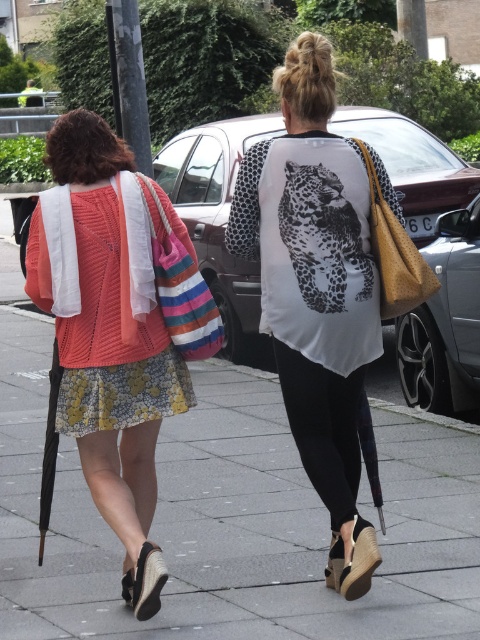
Question: Is gray concrete pavement at lower center behind knitted cotton sweater at left?

Choices:
 (A) yes
 (B) no

Answer: (A)

Question: Which object is farther from the camera taking this photo?

Choices:
 (A) white matte shirt at center
 (B) knitted cotton sweater at left
 (C) metallic silver car at center

Answer: (C)

Question: Which object appears closest to the camera in this image?

Choices:
 (A) gray concrete pavement at lower center
 (B) printed cotton dress at center
 (C) metallic silver car at center
 (D) white matte shirt at center

Answer: (D)

Question: Can you confirm if white matte shirt at center is wider than shiny black car at right?

Choices:
 (A) no
 (B) yes

Answer: (B)

Question: Does gray concrete pavement at lower center have a greater width compared to white matte shirt at center?

Choices:
 (A) no
 (B) yes

Answer: (A)

Question: Which point is closer to the camera?

Choices:
 (A) (84, 372)
 (B) (87, 189)

Answer: (A)